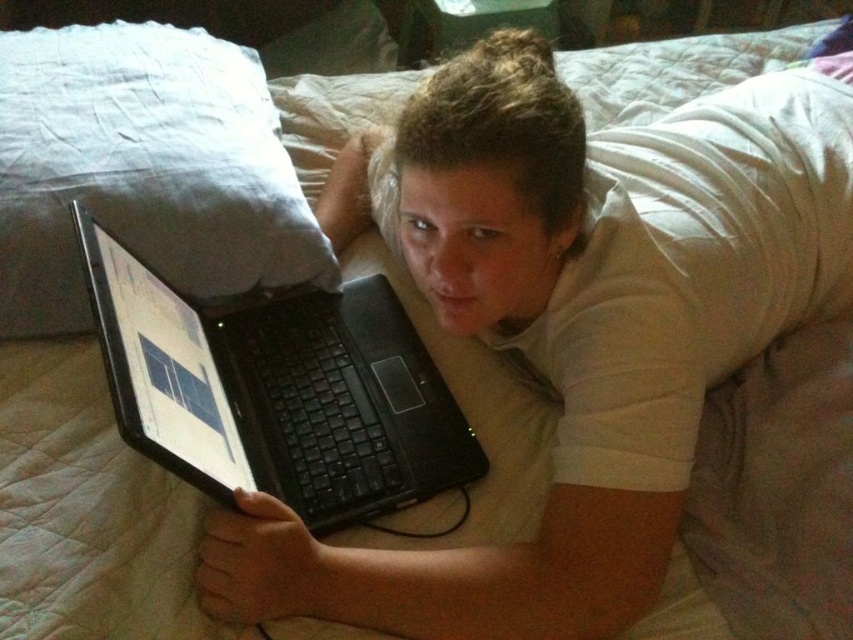
Question: Among these points, which one is farthest from the camera?

Choices:
 (A) (267, 349)
 (B) (102, 83)

Answer: (B)

Question: Considering the relative positions of white soft pillow at upper left and black matte laptop at center in the image provided, where is white soft pillow at upper left located with respect to black matte laptop at center?

Choices:
 (A) left
 (B) right

Answer: (A)

Question: From the image, what is the correct spatial relationship of white soft pillow at upper left in relation to black matte laptop at center?

Choices:
 (A) left
 (B) right

Answer: (A)

Question: Considering the relative positions of white soft pillow at upper left and black matte laptop at center in the image provided, where is white soft pillow at upper left located with respect to black matte laptop at center?

Choices:
 (A) above
 (B) below

Answer: (A)